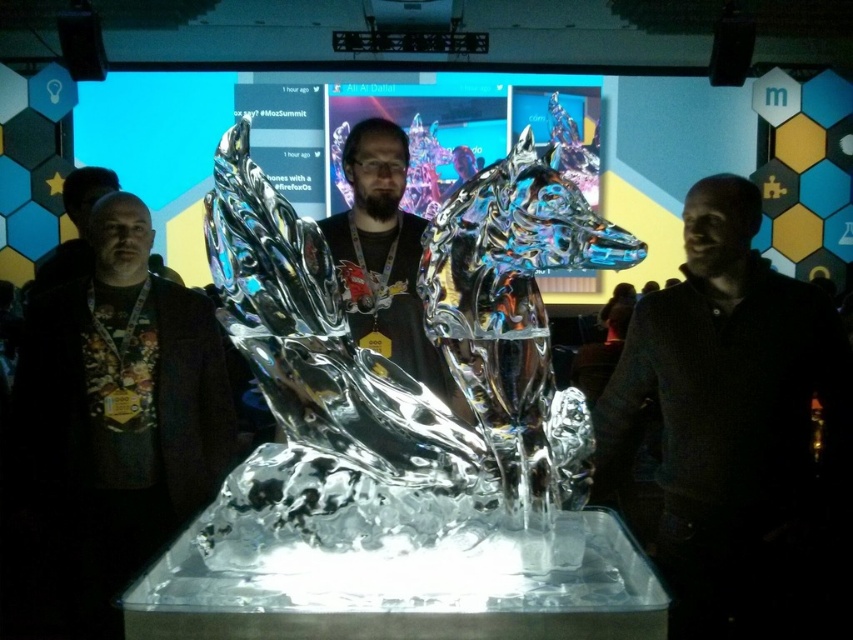
Question: Which object is closer to the camera taking this photo?

Choices:
 (A) dark brown leather jacket at center
 (B) clear glass horse at center
 (C) shiny metallic wolf head at center
 (D) dark gray sweater at right

Answer: (B)

Question: Based on their relative distances, which object is farther from the shiny metallic wolf head at center?

Choices:
 (A) clear glass horse at center
 (B) dark gray sweater at right

Answer: (B)

Question: Does clear glass horse at center have a lesser width compared to shiny metallic wolf head at center?

Choices:
 (A) yes
 (B) no

Answer: (B)

Question: Is clear glass horse at center below shiny metallic wolf head at center?

Choices:
 (A) yes
 (B) no

Answer: (A)

Question: Which object is closer to the camera taking this photo?

Choices:
 (A) dark gray sweater at right
 (B) shiny metallic wolf head at center
 (C) dark brown leather jacket at center
 (D) clear glass horse at center

Answer: (D)

Question: Can you confirm if dark gray sweater at right is positioned above dark brown leather jacket at center?

Choices:
 (A) yes
 (B) no

Answer: (B)